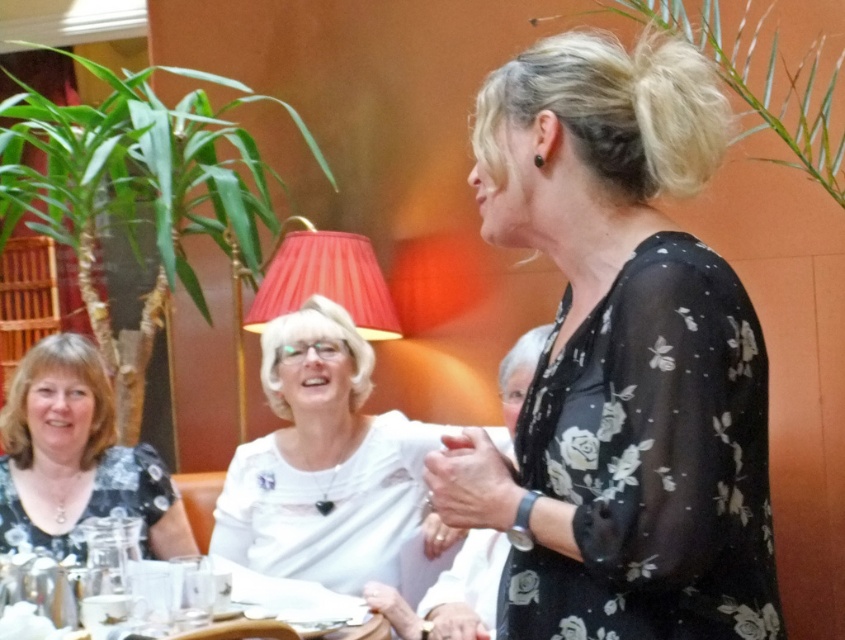
Is matte black dress at lower left taller than clear glassware at lower left?

Yes, matte black dress at lower left is taller than clear glassware at lower left.

Who is positioned more to the right, matte black dress at lower left or clear glassware at lower left?

clear glassware at lower left is more to the right.

What do you see at coordinates (77, 456) in the screenshot? The image size is (845, 640). I see `matte black dress at lower left` at bounding box center [77, 456].

At what (x,y) coordinates should I click in order to perform the action: click on matte black dress at lower left. Please return your answer as a coordinate pair (x, y). This screenshot has height=640, width=845. Looking at the image, I should click on (77, 456).

Can you confirm if black floral blouse at center is bigger than white satin blouse at center?

Incorrect, black floral blouse at center is not larger than white satin blouse at center.

Who is positioned more to the left, black floral blouse at center or white satin blouse at center?

From the viewer's perspective, white satin blouse at center appears more on the left side.

What do you see at coordinates (620, 360) in the screenshot? The width and height of the screenshot is (845, 640). I see `black floral blouse at center` at bounding box center [620, 360].

At what (x,y) coordinates should I click in order to perform the action: click on black floral blouse at center. Please return your answer as a coordinate pair (x, y). This screenshot has height=640, width=845. Looking at the image, I should click on (620, 360).

Which is more to the left, white satin blouse at center or matte black dress at lower left?

From the viewer's perspective, matte black dress at lower left appears more on the left side.

Is white satin blouse at center shorter than matte black dress at lower left?

In fact, white satin blouse at center may be taller than matte black dress at lower left.

The width and height of the screenshot is (845, 640). I want to click on white satin blouse at center, so pos(331,468).